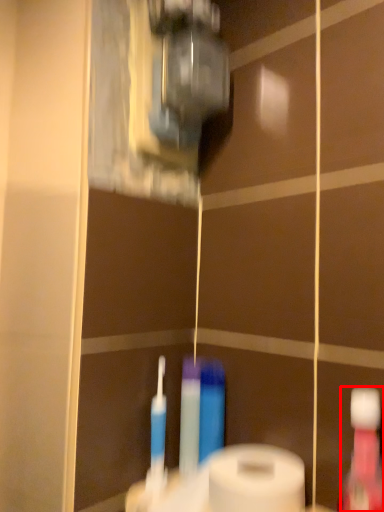
Question: In this image, where is mouthwash (annotated by the red box) located relative to toilet paper?

Choices:
 (A) right
 (B) left

Answer: (A)